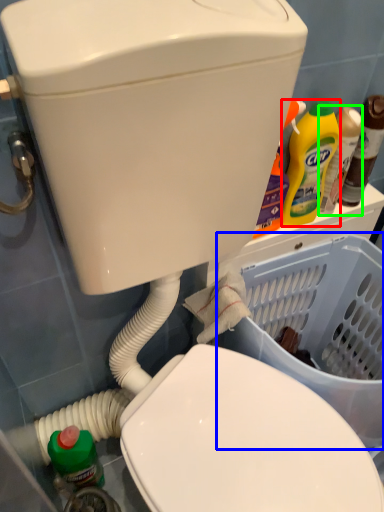
Question: Estimate the real-world distances between objects in this image. Which object is closer to cleaning product (highlighted by a red box), basket container (highlighted by a blue box) or bottle (highlighted by a green box)?

Choices:
 (A) basket container
 (B) bottle

Answer: (B)